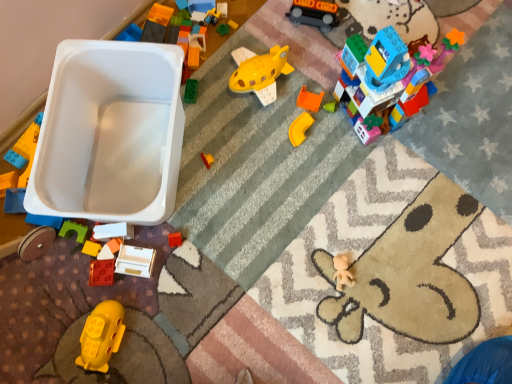
Where is `vacant area that is in front of rubberized orange block at lower left, acting as the fifth toy starting from the top`? vacant area that is in front of rubberized orange block at lower left, acting as the fifth toy starting from the top is located at coordinates (83, 311).